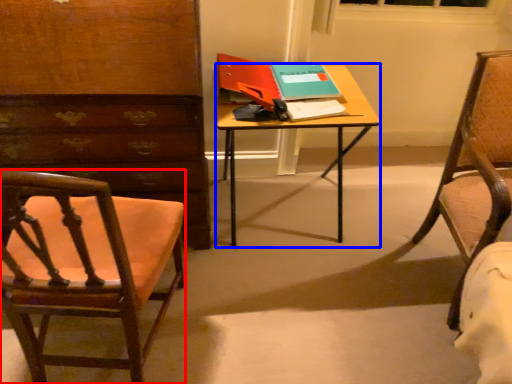
Question: Among these objects, which one is nearest to the camera, chair (highlighted by a red box) or desk (highlighted by a blue box)?

Choices:
 (A) chair
 (B) desk

Answer: (A)